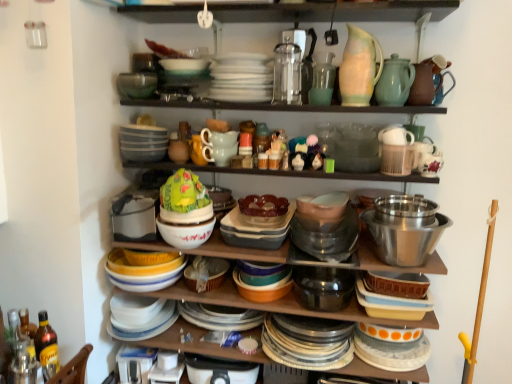
What do you see at coordinates (136, 84) in the screenshot? This screenshot has height=384, width=512. I see `green glass bowl at upper center, arranged as the fourth bowl when ordered from the bottom` at bounding box center [136, 84].

The width and height of the screenshot is (512, 384). I want to click on green glass bowl at upper center, arranged as the fourth bowl when ordered from the bottom, so click(136, 84).

What is the approximate height of polished stainless steel bowl at right, which is the 4th bowl from left to right?

20.19 centimeters.

Image resolution: width=512 pixels, height=384 pixels. What do you see at coordinates (135, 216) in the screenshot?
I see `matte white bowl at center` at bounding box center [135, 216].

Where is `green matte cake at center, which is the second food from right to left`? The width and height of the screenshot is (512, 384). green matte cake at center, which is the second food from right to left is located at coordinates (183, 192).

Measure the distance between matte ceramic bowls at center and camera.

They are 1.42 meters apart.

At what (x,y) coordinates should I click in order to perform the action: click on matte ceramic teapot at center, positioned as the 5th tableware in right-to-left order. Please return your answer as a coordinate pair (x, y). Image resolution: width=512 pixels, height=384 pixels. Looking at the image, I should click on (219, 146).

Can you confirm if translucent amber glass bottle at lower left is smaller than polished stainless steel bowl at right, which is the first bowl from right to left?

Correct, translucent amber glass bottle at lower left occupies less space than polished stainless steel bowl at right, which is the first bowl from right to left.

Consider the image. Is translucent amber glass bottle at lower left situated inside polished stainless steel bowl at right, the 3th bowl when ordered from top to bottom, or outside?

translucent amber glass bottle at lower left is not enclosed by polished stainless steel bowl at right, the 3th bowl when ordered from top to bottom.

From the image's perspective, which one is positioned higher, translucent amber glass bottle at lower left or polished stainless steel bowl at right, which is the 4th bowl from left to right?

polished stainless steel bowl at right, which is the 4th bowl from left to right, from the image's perspective.

Are translucent amber glass bottle at lower left and polished stainless steel bowl at right, which is the first bowl from right to left, far apart?

Yes, translucent amber glass bottle at lower left is far from polished stainless steel bowl at right, which is the first bowl from right to left.

Considering the relative sizes of matte ceramic bowl at center, positioned as the 2th bowl in left-to-right order, and polished stainless steel bowl at right, acting as the second bowl starting from the bottom, in the image provided, is matte ceramic bowl at center, positioned as the 2th bowl in left-to-right order, thinner than polished stainless steel bowl at right, acting as the second bowl starting from the bottom,?

Yes, matte ceramic bowl at center, positioned as the 2th bowl in left-to-right order, is thinner than polished stainless steel bowl at right, acting as the second bowl starting from the bottom.

Which is more to the right, matte ceramic bowl at center, the second bowl in the top-to-bottom sequence, or polished stainless steel bowl at right, which is the 4th bowl from left to right?

From the viewer's perspective, polished stainless steel bowl at right, which is the 4th bowl from left to right, appears more on the right side.

Considering the relative positions of matte ceramic bowl at center, which is the 3th bowl in bottom-to-top order, and polished stainless steel bowl at right, the 3th bowl when ordered from top to bottom, in the image provided, is matte ceramic bowl at center, which is the 3th bowl in bottom-to-top order, in front of polished stainless steel bowl at right, the 3th bowl when ordered from top to bottom,?

No, matte ceramic bowl at center, which is the 3th bowl in bottom-to-top order, is behind polished stainless steel bowl at right, the 3th bowl when ordered from top to bottom.

Can you confirm if matte ceramic bowl at center, which is the 3th bowl in bottom-to-top order, is shorter than polished stainless steel bowl at right, which is the first bowl from right to left?

Correct, matte ceramic bowl at center, which is the 3th bowl in bottom-to-top order, is not as tall as polished stainless steel bowl at right, which is the first bowl from right to left.

How far apart are white glossy platter at upper center and matte ceramic bowl at center, which is the third bowl from right to left?

white glossy platter at upper center is 21.28 inches from matte ceramic bowl at center, which is the third bowl from right to left.

Is matte ceramic bowl at center, which is the 3th bowl in bottom-to-top order, at the back of white glossy platter at upper center?

No, white glossy platter at upper center's orientation is not away from matte ceramic bowl at center, which is the 3th bowl in bottom-to-top order.

Does white glossy platter at upper center appear on the right side of matte ceramic bowl at center, the second bowl in the top-to-bottom sequence?

Correct, you'll find white glossy platter at upper center to the right of matte ceramic bowl at center, the second bowl in the top-to-bottom sequence.

From a real-world perspective, is white glossy platter at upper center physically located above or below matte ceramic bowl at center, which is the 3th bowl in bottom-to-top order?

white glossy platter at upper center is above matte ceramic bowl at center, which is the 3th bowl in bottom-to-top order.

Is matte ceramic teapot at center, positioned as the 1th tableware in left-to-right order, turned away from green matte cake at center, which is the second food from right to left?

No, matte ceramic teapot at center, positioned as the 1th tableware in left-to-right order, is not facing away from green matte cake at center, which is the second food from right to left.

From a real-world perspective, is matte ceramic teapot at center, positioned as the 5th tableware in right-to-left order, positioned above or below green matte cake at center, acting as the 1th food starting from the left?

matte ceramic teapot at center, positioned as the 5th tableware in right-to-left order, is situated higher than green matte cake at center, acting as the 1th food starting from the left, in the real world.

Is matte ceramic teapot at center, positioned as the 1th tableware in left-to-right order, in contact with green matte cake at center, which is the second food from right to left?

No, matte ceramic teapot at center, positioned as the 1th tableware in left-to-right order, is not next to green matte cake at center, which is the second food from right to left.

Is the depth of matte ceramic teapot at center, positioned as the 5th tableware in right-to-left order, greater than that of green matte cake at center, which is the second food from right to left?

Yes, the depth of matte ceramic teapot at center, positioned as the 5th tableware in right-to-left order, is greater than that of green matte cake at center, which is the second food from right to left.

Is translucent glass bowl at center, arranged as the 2th food when viewed from the left, at the back of matte ceramic teapot at center, positioned as the 1th tableware in left-to-right order?

matte ceramic teapot at center, positioned as the 1th tableware in left-to-right order, is not turned away from translucent glass bowl at center, arranged as the 2th food when viewed from the left.

Considering the sizes of objects matte ceramic teapot at center, positioned as the 5th tableware in right-to-left order, and translucent glass bowl at center, the first food when ordered from right to left, in the image provided, who is thinner, matte ceramic teapot at center, positioned as the 5th tableware in right-to-left order, or translucent glass bowl at center, the first food when ordered from right to left,?

matte ceramic teapot at center, positioned as the 5th tableware in right-to-left order, is thinner.

Based on the photo, visually, is matte ceramic teapot at center, positioned as the 5th tableware in right-to-left order, positioned to the left or to the right of translucent glass bowl at center, arranged as the 2th food when viewed from the left?

matte ceramic teapot at center, positioned as the 5th tableware in right-to-left order, is positioned on translucent glass bowl at center, arranged as the 2th food when viewed from the left,'s left side.

From the image's perspective, which one is positioned lower, matte ceramic bowl at center, which is the first bowl in bottom-to-top order, or green matte pitcher at upper right, which is the 4th tableware from left to right?

matte ceramic bowl at center, which is the first bowl in bottom-to-top order.

Is matte ceramic bowl at center, the 3th bowl positioned from the left, to the left or to the right of green matte pitcher at upper right, positioned as the 2th tableware in right-to-left order, in the image?

matte ceramic bowl at center, the 3th bowl positioned from the left, is positioned on green matte pitcher at upper right, positioned as the 2th tableware in right-to-left order,'s left side.

Is point (214, 273) farther from viewer compared to point (381, 90)?

Yes.

Is matte ceramic bowl at center, marked as the 4th bowl in a top-to-bottom arrangement, facing away from green matte pitcher at upper right, which is the 4th tableware from left to right?

matte ceramic bowl at center, marked as the 4th bowl in a top-to-bottom arrangement, does not have its back to green matte pitcher at upper right, which is the 4th tableware from left to right.

How different are the orientations of matte ceramic bowl at center, the second bowl in the top-to-bottom sequence, and translucent amber glass bottle at lower left in degrees?

There is a 89.6-degree angle between the facing directions of matte ceramic bowl at center, the second bowl in the top-to-bottom sequence, and translucent amber glass bottle at lower left.

Is matte ceramic bowl at center, the second bowl in the top-to-bottom sequence, not near translucent amber glass bottle at lower left?

Actually, matte ceramic bowl at center, the second bowl in the top-to-bottom sequence, and translucent amber glass bottle at lower left are a little close together.

Is matte ceramic bowl at center, the second bowl in the top-to-bottom sequence, to the left or to the right of translucent amber glass bottle at lower left in the image?

matte ceramic bowl at center, the second bowl in the top-to-bottom sequence, is to the right of translucent amber glass bottle at lower left.

Is matte ceramic bowl at center, which is the third bowl from right to left, outside of translucent amber glass bottle at lower left?

Yes, matte ceramic bowl at center, which is the third bowl from right to left, is outside of translucent amber glass bottle at lower left.

I want to click on bottle that is below the polished stainless steel bowl at right, which is the 4th bowl from left to right (from the image's perspective), so click(46, 346).

From a real-world perspective, count 1st bowls downward from the polished stainless steel bowl at right, which is the 4th bowl from left to right, and point to it. Please provide its 2D coordinates.

[(185, 233)]

Considering their positions, is matte ceramic teapot at center, positioned as the 5th tableware in right-to-left order, positioned closer to green matte pitcher at upper right, which is the 4th tableware from left to right, than translucent glass bowl at center, the first food when ordered from right to left?

matte ceramic teapot at center, positioned as the 5th tableware in right-to-left order.

In the scene shown: Considering their positions, is white glossy platter at upper center positioned further to matte white bowl at center than matte ceramic bowl at center, the second bowl in the top-to-bottom sequence?

white glossy platter at upper center lies further to matte white bowl at center than the other object.

From the image, which object appears to be farther from green matte pitcher at upper right, positioned as the 2th tableware in right-to-left order, green matte cake at center, which is the second food from right to left, or speckled ceramic pitcher at upper center, arranged as the third tableware when viewed from the right?

green matte cake at center, which is the second food from right to left, is further to green matte pitcher at upper right, positioned as the 2th tableware in right-to-left order.

When comparing their distances from green matte cake at center, which is the second food from right to left, does green matte pitcher at upper right, which is the 4th tableware from left to right, or matte ceramic teapot at center, positioned as the 1th tableware in left-to-right order, seem closer?

Based on the image, matte ceramic teapot at center, positioned as the 1th tableware in left-to-right order, appears to be nearer to green matte cake at center, which is the second food from right to left.

Which object lies further to the anchor point matte ceramic bowl at center, which is the third bowl from right to left, matte white bowl at center or green matte cake at center, which is the second food from right to left?

Among the two, matte white bowl at center is located further to matte ceramic bowl at center, which is the third bowl from right to left.

Looking at this image, from the image, which object appears to be farther from polished stainless steel bowl at right, acting as the second bowl starting from the bottom, matte glass vase at upper center, which is the fourth tableware from right to left, or matte ceramic bowl at center, which is the 3th bowl in bottom-to-top order?

Based on the image, matte ceramic bowl at center, which is the 3th bowl in bottom-to-top order, appears to be further to polished stainless steel bowl at right, acting as the second bowl starting from the bottom.

Considering their positions, is matte white bowl at center positioned further to matte ceramic bowl at center, the 3th bowl positioned from the left, than translucent amber glass bottle at lower left?

translucent amber glass bottle at lower left.

Based on their spatial positions, is green matte cake at center, acting as the 1th food starting from the left, or matte glass vase at upper center, which is the fourth tableware from right to left, closer to speckled ceramic pitcher at upper center, the third tableware positioned from the left?

matte glass vase at upper center, which is the fourth tableware from right to left, is positioned closer to the anchor speckled ceramic pitcher at upper center, the third tableware positioned from the left.

This screenshot has width=512, height=384. Find the location of `tableware between speckled ceramic pitcher at upper center, the third tableware positioned from the left, and matte brown pitcher at upper right, arranged as the first tableware when viewed from the right, in the horizontal direction`. tableware between speckled ceramic pitcher at upper center, the third tableware positioned from the left, and matte brown pitcher at upper right, arranged as the first tableware when viewed from the right, in the horizontal direction is located at coordinates (394, 81).

Identify the location of food between matte ceramic bowl at center, positioned as the 2th bowl in left-to-right order, and matte brown pitcher at upper right, the fifth tableware in the left-to-right sequence, from left to right. (263, 206).

Locate an element on the screen. platter located between matte ceramic bowl at center, positioned as the 2th bowl in left-to-right order, and matte brown pitcher at upper right, arranged as the first tableware when viewed from the right, in the left-right direction is located at coordinates (241, 78).

Where is `tableware situated between green glass bowl at upper center, acting as the 4th bowl starting from the right, and white glossy platter at upper center from left to right`? This screenshot has height=384, width=512. tableware situated between green glass bowl at upper center, acting as the 4th bowl starting from the right, and white glossy platter at upper center from left to right is located at coordinates (219, 146).